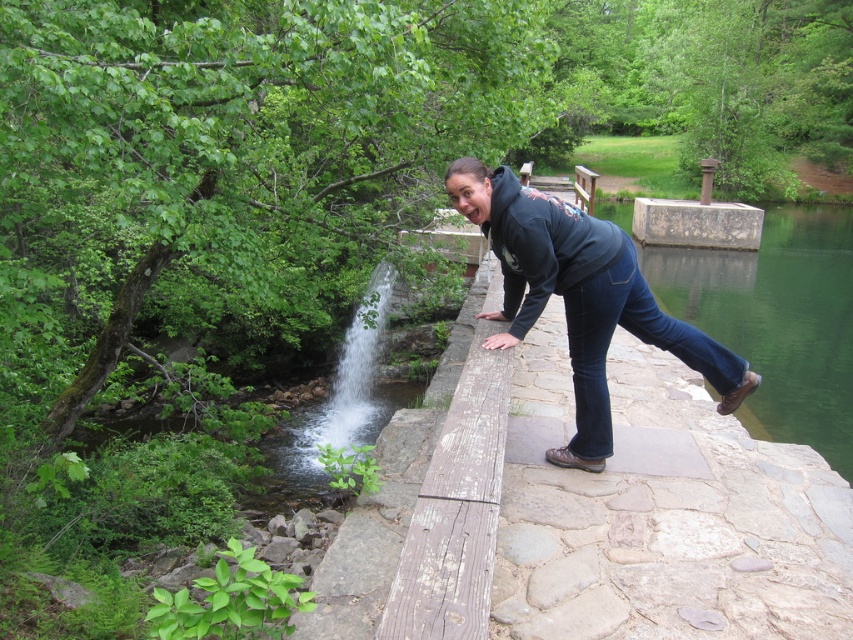
Question: Among these objects, which one is nearest to the camera?

Choices:
 (A) clear water at center
 (B) dark blue hoodie at center

Answer: (B)

Question: Is dark blue hoodie at center to the right of clear water at center from the viewer's perspective?

Choices:
 (A) no
 (B) yes

Answer: (B)

Question: Among these objects, which one is farthest from the camera?

Choices:
 (A) clear water at center
 (B) dark blue hoodie at center

Answer: (A)

Question: Observing the image, what is the correct spatial positioning of dark blue hoodie at center in reference to clear water at center?

Choices:
 (A) left
 (B) right

Answer: (B)

Question: Where is dark blue hoodie at center located in relation to clear water at center in the image?

Choices:
 (A) above
 (B) below

Answer: (B)